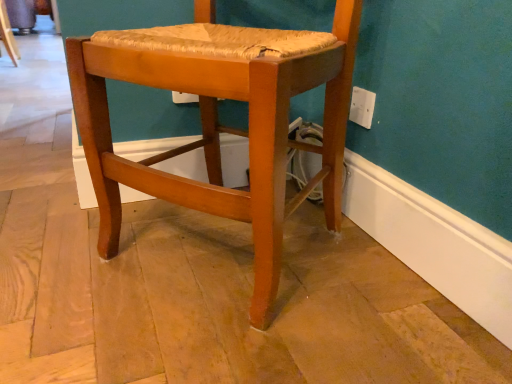
Question: From their relative heights in the image, would you say matte wood chair at center is taller or shorter than white plastic electric outlet at upper right?

Choices:
 (A) tall
 (B) short

Answer: (A)

Question: Considering the positions of point (261, 157) and point (358, 114), is point (261, 157) closer or farther from the camera than point (358, 114)?

Choices:
 (A) closer
 (B) farther

Answer: (A)

Question: Is matte wood chair at center in front of or behind white plastic electric outlet at upper right in the image?

Choices:
 (A) behind
 (B) front

Answer: (B)

Question: From a real-world perspective, is white plastic electric outlet at upper right positioned above or below matte wood chair at center?

Choices:
 (A) below
 (B) above

Answer: (B)

Question: Is white plastic electric outlet at upper right inside the boundaries of matte wood chair at center, or outside?

Choices:
 (A) inside
 (B) outside

Answer: (B)

Question: From their relative heights in the image, would you say white plastic electric outlet at upper right is taller or shorter than matte wood chair at center?

Choices:
 (A) short
 (B) tall

Answer: (A)

Question: Is white plastic electric outlet at upper right bigger or smaller than matte wood chair at center?

Choices:
 (A) small
 (B) big

Answer: (A)